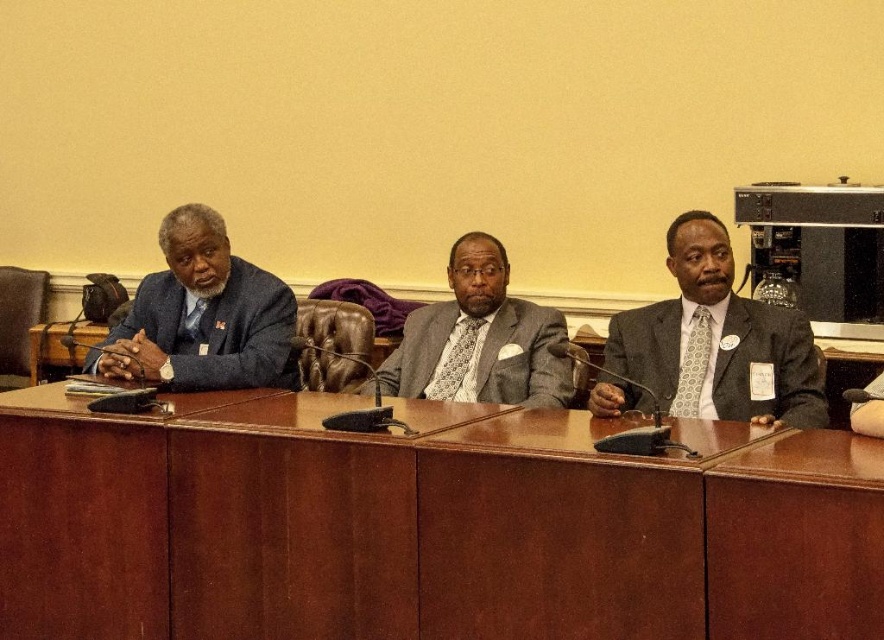
Question: Can you confirm if matte gray suit at right is positioned below matte black suit at left?

Choices:
 (A) no
 (B) yes

Answer: (B)

Question: Is matte gray suit at right to the left of matte gray suit at center from the viewer's perspective?

Choices:
 (A) no
 (B) yes

Answer: (A)

Question: Observing the image, what is the correct spatial positioning of brown wood table at center in reference to matte black suit at left?

Choices:
 (A) below
 (B) above

Answer: (A)

Question: Which of the following is the closest to the observer?

Choices:
 (A) matte black suit at left
 (B) brown wood table at center
 (C) matte gray suit at right

Answer: (B)

Question: Which object is farther from the camera taking this photo?

Choices:
 (A) matte black suit at left
 (B) brown wood table at center

Answer: (A)

Question: Among these points, which one is farthest from the camera?

Choices:
 (A) (454, 314)
 (B) (168, 308)

Answer: (A)